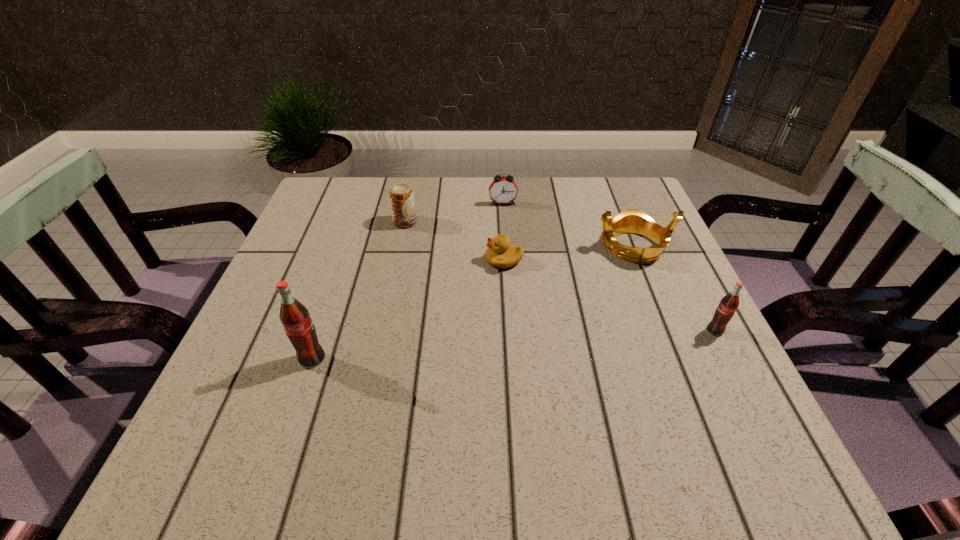
Image resolution: width=960 pixels, height=540 pixels. In order to click on vacant space that's between the shortest object and the fifth farthest object in this screenshot , I will do `click(610, 295)`.

Locate an element on the screen. The width and height of the screenshot is (960, 540). unoccupied position between the alarm clock and the tallest object is located at coordinates (407, 281).

Locate an element on the screen. This screenshot has height=540, width=960. vacant region between the left soda bottle and the right soda bottle is located at coordinates (514, 345).

The height and width of the screenshot is (540, 960). What are the coordinates of `blank region between the second object from left to right and the nearest object` in the screenshot? It's located at (358, 291).

Where is `vacant area between the fifth object from right to left and the shortest object`? The width and height of the screenshot is (960, 540). vacant area between the fifth object from right to left and the shortest object is located at coordinates (454, 241).

Identify the location of empty space that is in between the farthest object and the beer can. This screenshot has width=960, height=540. tap(454, 213).

The width and height of the screenshot is (960, 540). In order to click on unoccupied position between the tallest object and the right soda bottle in this screenshot , I will do `click(514, 345)`.

This screenshot has width=960, height=540. I want to click on vacant area that lies between the right soda bottle and the alarm clock, so click(609, 267).

Find the location of a particular element. The width and height of the screenshot is (960, 540). unoccupied position between the fifth object from right to left and the tiara is located at coordinates [x=518, y=234].

Image resolution: width=960 pixels, height=540 pixels. Identify the location of object that is the second nearest to the duckling. (629, 221).